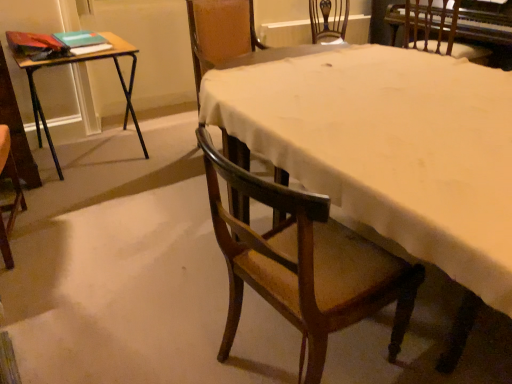
Identify the location of vacant area that is in front of wooden folding table at left. The image size is (512, 384). (87, 208).